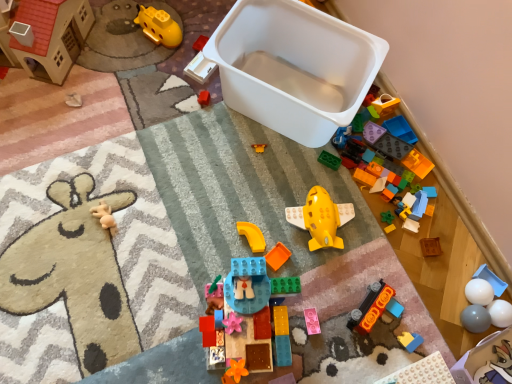
This screenshot has width=512, height=384. Identify the location of free location to the right of white plastic tray at upper center, placed as the 13th toy when sorted from right to left. (253, 76).